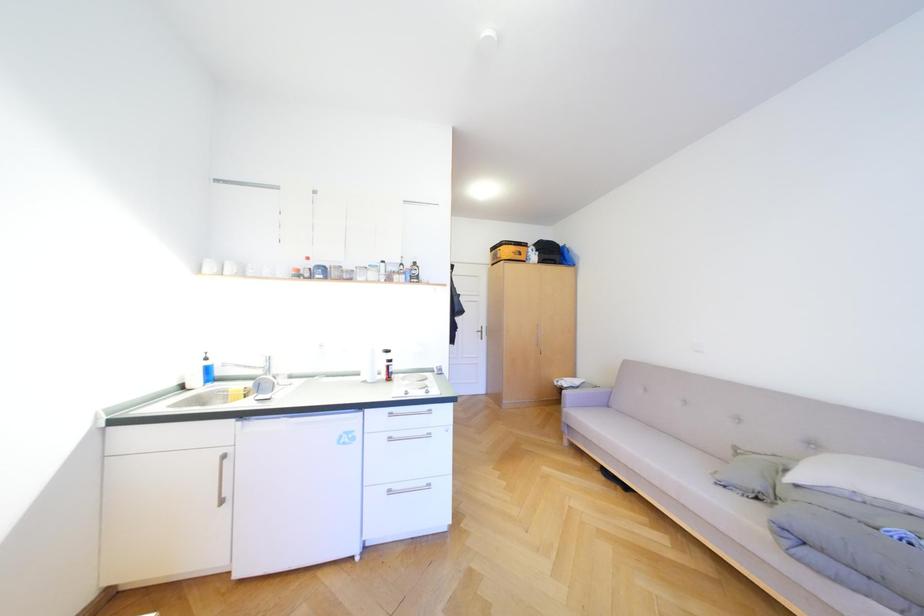
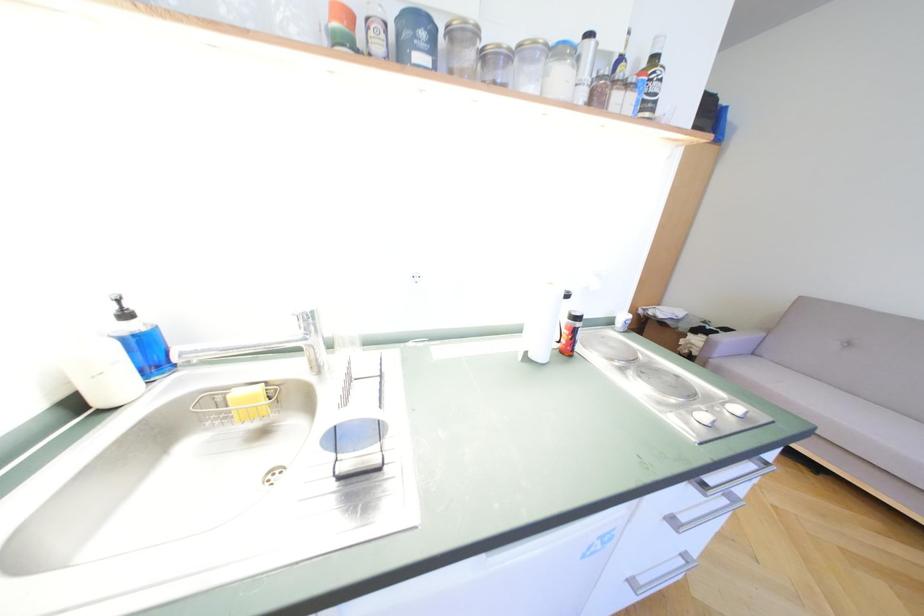
Which direction would the cameraman need to move to produce the second image?

The movement direction of the cameraman is left, forward.